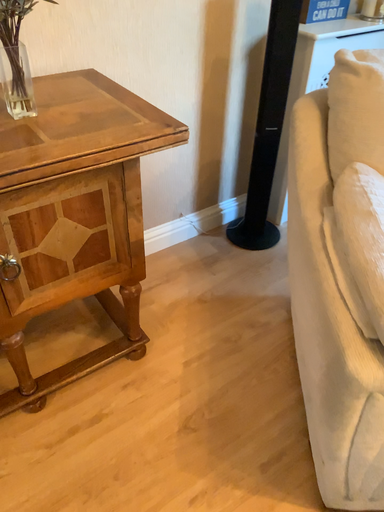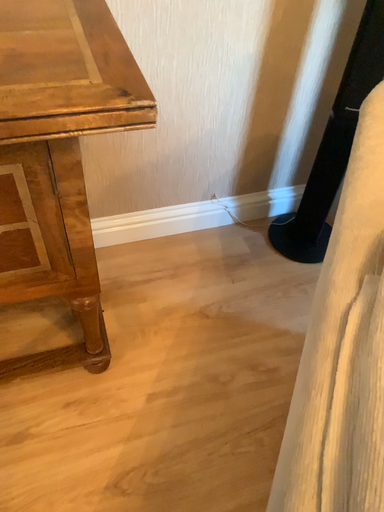
Question: How did the camera likely rotate when shooting the video?

Choices:
 (A) rotated downward
 (B) rotated upward

Answer: (A)